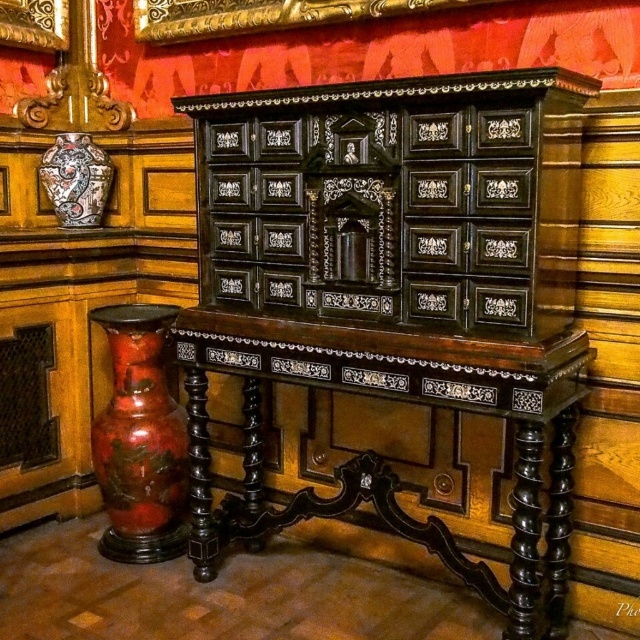
Question: Is black polished wood table at center further to the viewer compared to decorative ceramic vase at left?

Choices:
 (A) yes
 (B) no

Answer: (B)

Question: Is rustic terracotta vase at left thinner than gold ornate picture frame at upper center?

Choices:
 (A) yes
 (B) no

Answer: (B)

Question: Which point is farther to the camera?

Choices:
 (A) (38, 164)
 (B) (28, 36)
 (C) (113, 326)

Answer: (A)

Question: Based on their relative distances, which object is farther from the decorative ceramic vase at left?

Choices:
 (A) black polished wood table at center
 (B) rustic terracotta vase at left

Answer: (A)

Question: Which object is farther from the camera taking this photo?

Choices:
 (A) gold ornate picture frame at upper center
 (B) decorative ceramic vase at left
 (C) black polished wood table at center
 (D) rustic terracotta vase at left

Answer: (B)

Question: Does rustic terracotta vase at left come in front of gold ornate picture frame at upper center?

Choices:
 (A) yes
 (B) no

Answer: (A)